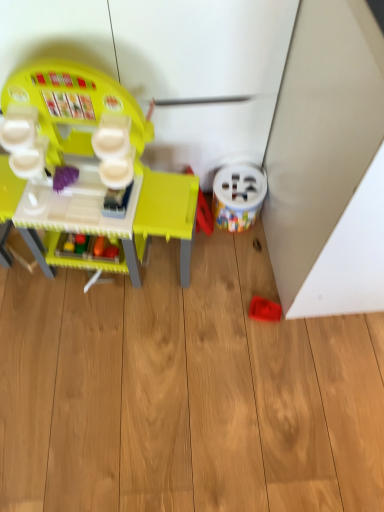
The height and width of the screenshot is (512, 384). Identify the location of free space behind rubberized red toy at lower right, which appears as the 1th toy when viewed from the right. (248, 270).